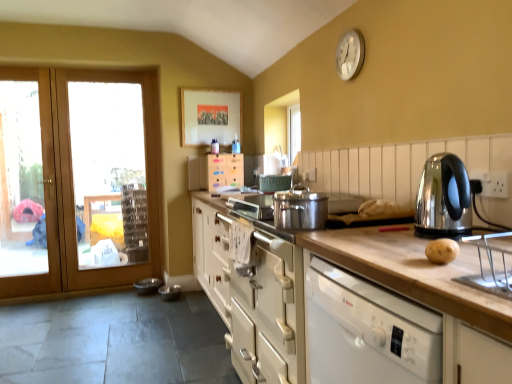
Identify the location of vacant space to the right of smooth yellow potato at right. (479, 250).